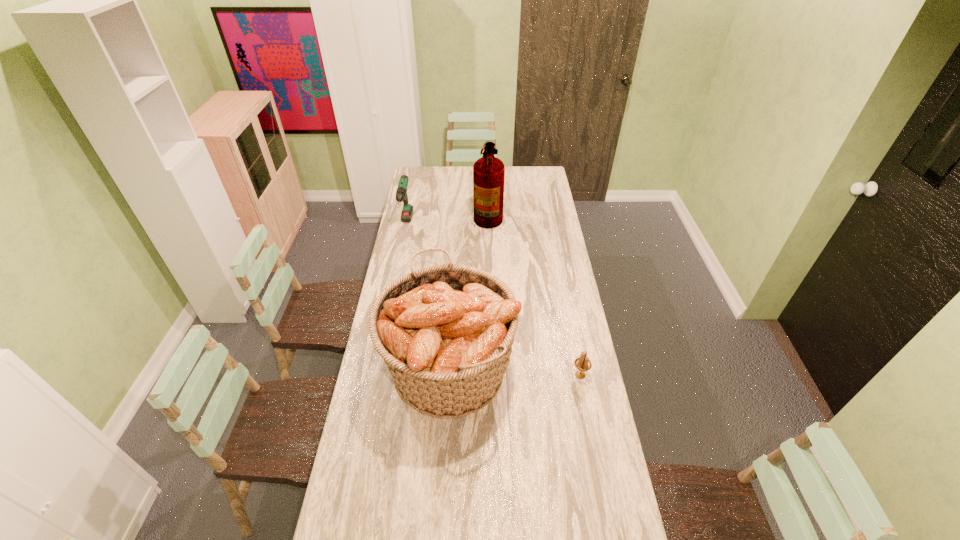
Locate an element on the screen. The height and width of the screenshot is (540, 960). vacant space that satisfies the following two spatial constraints: 1. on the handle side of the second shortest object; 2. on the right side of the candle holder is located at coordinates (375, 375).

Where is `free space that satisfies the following two spatial constraints: 1. at the nozzle of the tallest object; 2. on the back side of the shortest object`? free space that satisfies the following two spatial constraints: 1. at the nozzle of the tallest object; 2. on the back side of the shortest object is located at coordinates (492, 375).

The height and width of the screenshot is (540, 960). In order to click on vacant position in the image that satisfies the following two spatial constraints: 1. on the handle side of the candle holder; 2. on the right side of the drill in this screenshot , I will do `click(375, 375)`.

You are a GUI agent. You are given a task and a screenshot of the screen. Output one action in this format:
    pyautogui.click(x=<x>, y=<y>)
    Task: Click on the vacant space that satisfies the following two spatial constraints: 1. at the nozzle of the tallest object; 2. on the right side of the shortest object
    The width and height of the screenshot is (960, 540).
    Given the screenshot: What is the action you would take?
    pyautogui.click(x=492, y=375)

At what (x,y) coordinates should I click in order to perform the action: click on free space in the image that satisfies the following two spatial constraints: 1. on the handle side of the candle holder; 2. on the left side of the drill. Please return your answer as a coordinate pair (x, y). The height and width of the screenshot is (540, 960). Looking at the image, I should click on (375, 375).

This screenshot has width=960, height=540. Find the location of `free space in the image that satisfies the following two spatial constraints: 1. at the nozzle of the candle holder; 2. on the right side of the tallest object`. free space in the image that satisfies the following two spatial constraints: 1. at the nozzle of the candle holder; 2. on the right side of the tallest object is located at coordinates (492, 375).